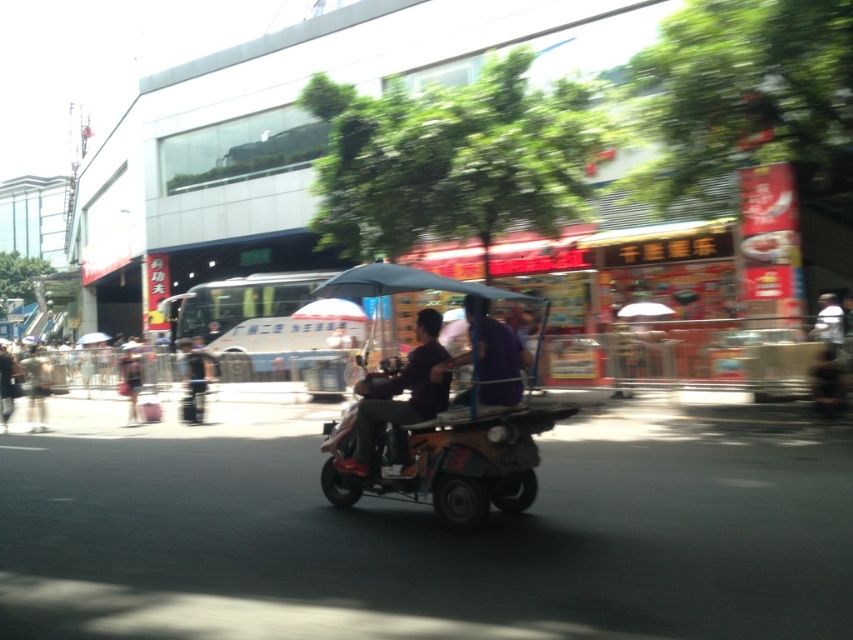
You are a delivery person who needs to place the black fabric suitcase at left into a storage compartment. However, the compartment has a height restriction. Can you determine if the purple matte shirt at center is blocking the entrance to the compartment?

The purple matte shirt at center is positioned over the black fabric suitcase at left, which means it is blocking the entrance to the storage compartment. Therefore, you must remove the purple matte shirt at center before placing the black fabric suitcase at left into the compartment.

You are a photographer standing on the street and want to take a photo of both the dark purple shirt at center and the purple matte shirt at center. Which one will appear closer to you in the photo?

The dark purple shirt at center will appear closer to you in the photo because it is further to the viewer than the purple matte shirt at center.

You are a delivery person who needs to deliver a package to a customer standing under a matte black umbrella at center. Your delivery vehicle is parked 3 meters away from the purple matte shirt at center. Can you reach the customer without moving your vehicle?

The purple matte shirt at center is 2.17 meters from the matte black umbrella at center. Since your vehicle is parked 3 meters away from the purple matte shirt at center, you would need to walk approximately 2.17 meters from the shirt to the umbrella. This means you can reach the customer by walking from your vehicle to the shirt and then to the umbrella, totaling about 5.17 meters. Therefore, you can reach the customer without needing to move your vehicle.